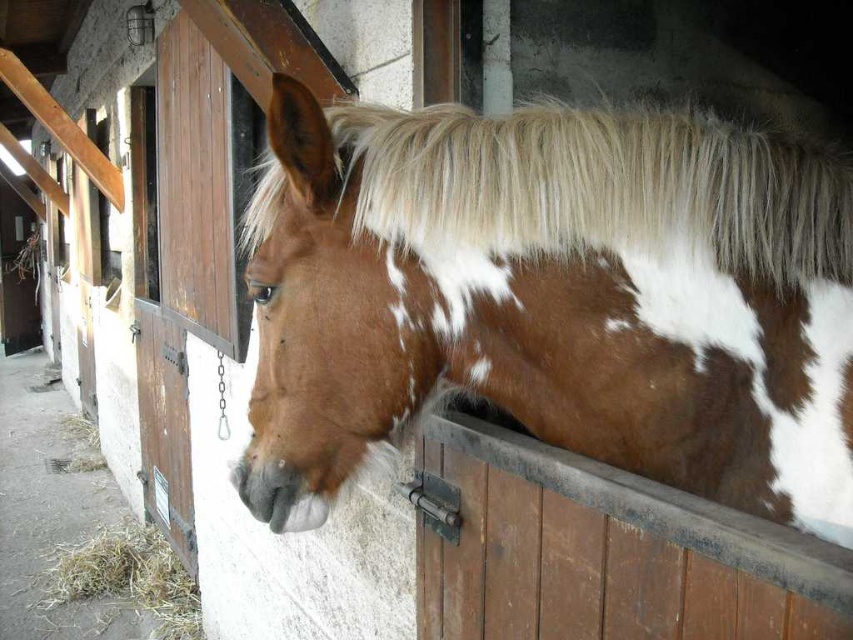
You are standing in front of the stable and notice two points marked on the wall. The first point is at coordinates point (784, 332) and the second at point (384, 131). Which point is closer to you?

Point (784, 332) is further to the viewer than point (384, 131), so the second point is closer to you.

Based on the photo, you are a farmer checking the stable. You notice the brown speckled fur at center and the yellow dry hay at lower left. Which object is located higher in the stable?

The brown speckled fur at center is positioned over the yellow dry hay at lower left, so it is higher up in the stable.

What is the 2D coordinate of the brown speckled fur at center in the image?

The brown speckled fur at center is located at the 2D coordinate point of (553, 298).